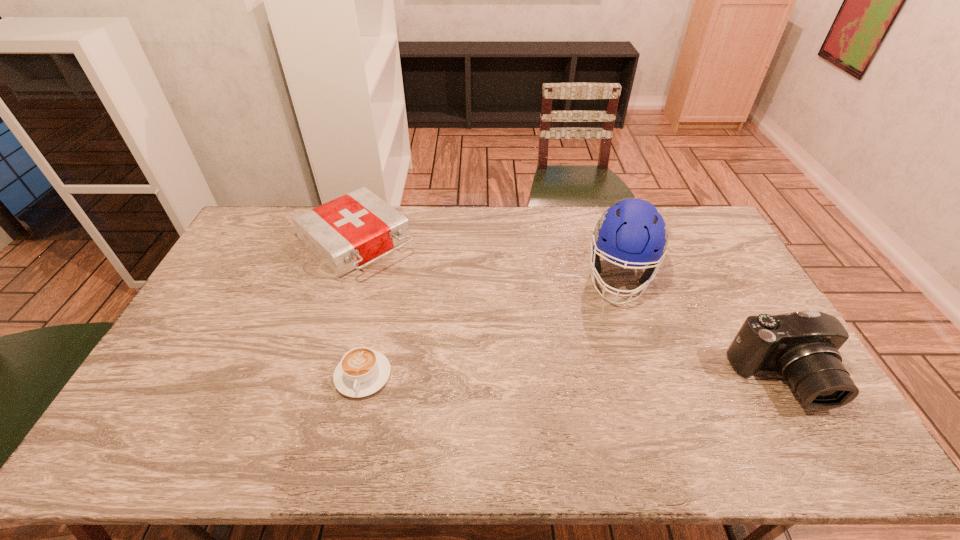
The width and height of the screenshot is (960, 540). I want to click on vacant space that's between the cappuccino and the third shortest object, so click(x=572, y=378).

This screenshot has height=540, width=960. I want to click on empty space that is in between the tallest object and the first-aid kit, so click(x=489, y=259).

Identify which object is located as the third nearest to the cappuccino. Please provide its 2D coordinates. Your answer should be formatted as a tuple, i.e. [(x, y)], where the tuple contains the x and y coordinates of a point satisfying the conditions above.

[(802, 346)]

Select which object appears as the closest to the football helmet. Please provide its 2D coordinates. Your answer should be formatted as a tuple, i.e. [(x, y)], where the tuple contains the x and y coordinates of a point satisfying the conditions above.

[(802, 346)]